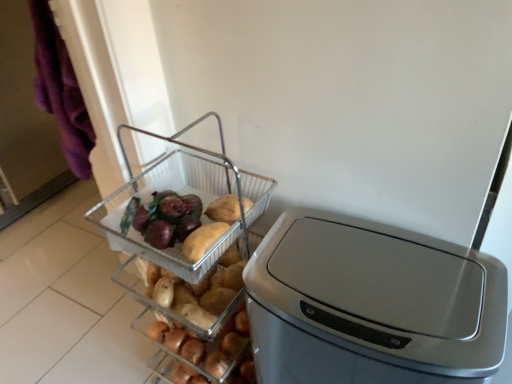
What do you see at coordinates (183, 194) in the screenshot? The height and width of the screenshot is (384, 512). I see `clear plastic basket at center` at bounding box center [183, 194].

The image size is (512, 384). In order to click on clear plastic basket at center in this screenshot , I will do `click(183, 194)`.

At what (x,y) coordinates should I click in order to perform the action: click on clear plastic basket at center. Please return your answer as a coordinate pair (x, y). Looking at the image, I should click on (188, 247).

The image size is (512, 384). I want to click on satin silver trash can at center, so click(371, 305).

This screenshot has height=384, width=512. Find the location of `clear plastic basket at center`. clear plastic basket at center is located at coordinates (183, 194).

From the image's perspective, which is below, clear plastic basket at center or clear plastic basket at center?

clear plastic basket at center.

The height and width of the screenshot is (384, 512). In order to click on basket that appears behind the clear plastic basket at center in this screenshot , I will do `click(183, 194)`.

Which is behind, clear plastic basket at center or clear plastic basket at center?

clear plastic basket at center.

Can satin silver trash can at center be found inside clear plastic basket at center?

No, satin silver trash can at center is located outside of clear plastic basket at center.

Which object is positioned more to the right, clear plastic basket at center or satin silver trash can at center?

From the viewer's perspective, satin silver trash can at center appears more on the right side.

From the image's perspective, who appears lower, clear plastic basket at center or satin silver trash can at center?

From the image's view, satin silver trash can at center is below.

Considering the relative sizes of clear plastic basket at center and satin silver trash can at center in the image provided, is clear plastic basket at center taller than satin silver trash can at center?

No.

How different are the orientations of satin silver trash can at center and clear plastic basket at center in degrees?

1.18 degrees.

Between satin silver trash can at center and clear plastic basket at center, which one has smaller width?

clear plastic basket at center is thinner.

Is satin silver trash can at center directly adjacent to clear plastic basket at center?

There is a gap between satin silver trash can at center and clear plastic basket at center.

Between clear plastic basket at center and clear plastic basket at center, which one is positioned in front?

Positioned in front is clear plastic basket at center.

Considering the sizes of objects clear plastic basket at center and clear plastic basket at center in the image provided, who is thinner, clear plastic basket at center or clear plastic basket at center?

Thinner between the two is clear plastic basket at center.

What's the angular difference between clear plastic basket at center and clear plastic basket at center's facing directions?

The angular difference between clear plastic basket at center and clear plastic basket at center is 0.000265 degrees.

From a real-world perspective, is clear plastic basket at center positioned above or below clear plastic basket at center?

clear plastic basket at center is situated lower than clear plastic basket at center in the real world.

Which is correct: clear plastic basket at center is inside satin silver trash can at center, or outside of it?

The correct answer is: outside.

The width and height of the screenshot is (512, 384). What are the coordinates of `appliance behind the satin silver trash can at center` in the screenshot? It's located at (188, 247).

Measure the distance between clear plastic basket at center and satin silver trash can at center.

9.69 inches.

Relative to satin silver trash can at center, is clear plastic basket at center in front or behind?

clear plastic basket at center is behind satin silver trash can at center.

Can you see satin silver trash can at center touching clear plastic basket at center?

No, satin silver trash can at center is not beside clear plastic basket at center.

Does satin silver trash can at center appear on the left side of clear plastic basket at center?

Incorrect, satin silver trash can at center is not on the left side of clear plastic basket at center.

Does point (344, 246) come in front of point (192, 223)?

Yes, point (344, 246) is in front of point (192, 223).

In the scene shown: How much distance is there between satin silver trash can at center and clear plastic basket at center?

satin silver trash can at center is 9.69 inches away from clear plastic basket at center.

Locate an element on the screen. basket on the left side of clear plastic basket at center is located at coordinates (183, 194).

Locate an element on the screen. The height and width of the screenshot is (384, 512). home appliance that is below the clear plastic basket at center (from the image's perspective) is located at coordinates tap(371, 305).

Consider the image. Estimate the real-world distances between objects in this image. Which object is closer to clear plastic basket at center, satin silver trash can at center or clear plastic basket at center?

clear plastic basket at center lies closer to clear plastic basket at center than the other object.

Based on their spatial positions, is clear plastic basket at center or clear plastic basket at center closer to satin silver trash can at center?

clear plastic basket at center is closer to satin silver trash can at center.

From the image, which object appears to be nearer to clear plastic basket at center, clear plastic basket at center or satin silver trash can at center?

clear plastic basket at center is closer to clear plastic basket at center.

From the image, which object appears to be farther from satin silver trash can at center, clear plastic basket at center or clear plastic basket at center?

Among the two, clear plastic basket at center is located further to satin silver trash can at center.

Estimate the real-world distances between objects in this image. Which object is closer to clear plastic basket at center, satin silver trash can at center or clear plastic basket at center?

The object closer to clear plastic basket at center is clear plastic basket at center.

Based on their spatial positions, is clear plastic basket at center or satin silver trash can at center further from clear plastic basket at center?

Based on the image, satin silver trash can at center appears to be further to clear plastic basket at center.

The image size is (512, 384). Find the location of `appliance located between clear plastic basket at center and satin silver trash can at center in the left-right direction`. appliance located between clear plastic basket at center and satin silver trash can at center in the left-right direction is located at coordinates (188, 247).